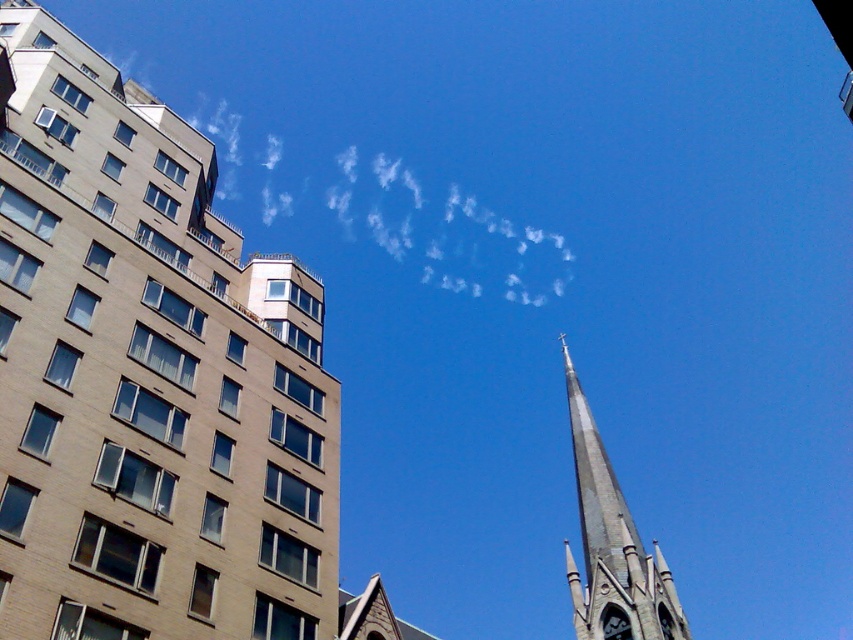
You are an architect analyzing the urban layout. From your viewpoint, does the gray stone steeple at center block the view of the black glossy clock at upper center?

The gray stone steeple at center is in front of the black glossy clock at upper center, so yes, the steeple blocks the view of the clock.

You are standing at the center of the image and want to walk directly towards the gray stone spire at center. Which direction should you move? The answer must be either north, south, east, or west.

The gray stone spire at center is located at coordinates point (148, 376). Since the center of the image is at (426, 320), moving towards the spire would require moving northeast. However, since the question specifies only north, south, east, or west, the closest direction would be east because the x coordinate of the spire is higher than 0.5, indicating it is to the east. Wait, but the y coordinate is lower than 0.5, which would be south. Hmm, need to clarify. The coordinates are likely in x,y where x is 0